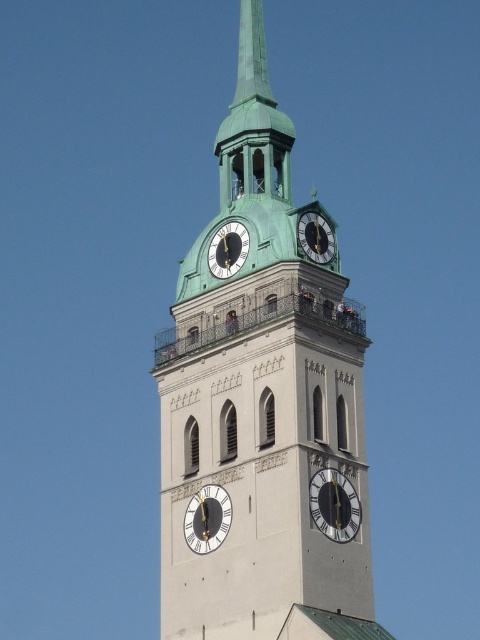
Is green polished wood spire at upper center bigger than silver metallic clock at center?

Yes.

Can you confirm if green polished wood spire at upper center is shorter than silver metallic clock at center?

In fact, green polished wood spire at upper center may be taller than silver metallic clock at center.

Does point (244, 100) come in front of point (335, 515)?

That is False.

Locate an element on the screen. The height and width of the screenshot is (640, 480). green polished wood spire at upper center is located at coordinates (250, 113).

Is green polished metal spire at upper center below metallic gold clock at upper center?

No.

Can you confirm if green polished metal spire at upper center is smaller than metallic gold clock at upper center?

Actually, green polished metal spire at upper center might be larger than metallic gold clock at upper center.

Where is `green polished metal spire at upper center`? green polished metal spire at upper center is located at coordinates (252, 56).

Between silver metallic clock at center and matte black clock at upper center, which one appears on the left side from the viewer's perspective?

Positioned to the left is matte black clock at upper center.

Is point (326, 528) positioned before point (244, 228)?

That is True.

Is point (336, 516) in front of point (225, 260)?

Yes, point (336, 516) is closer to viewer.

I want to click on silver metallic clock at center, so pos(334,506).